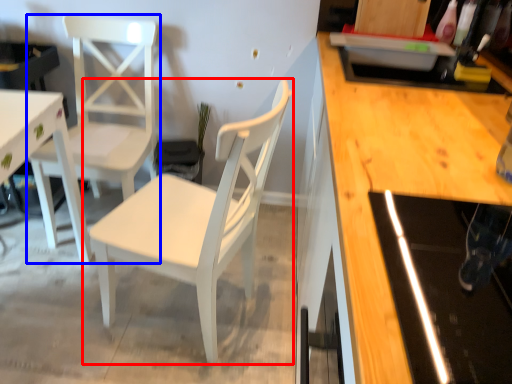
Question: Which object appears farthest to the camera in this image, chair (highlighted by a red box) or chair (highlighted by a blue box)?

Choices:
 (A) chair
 (B) chair

Answer: (B)